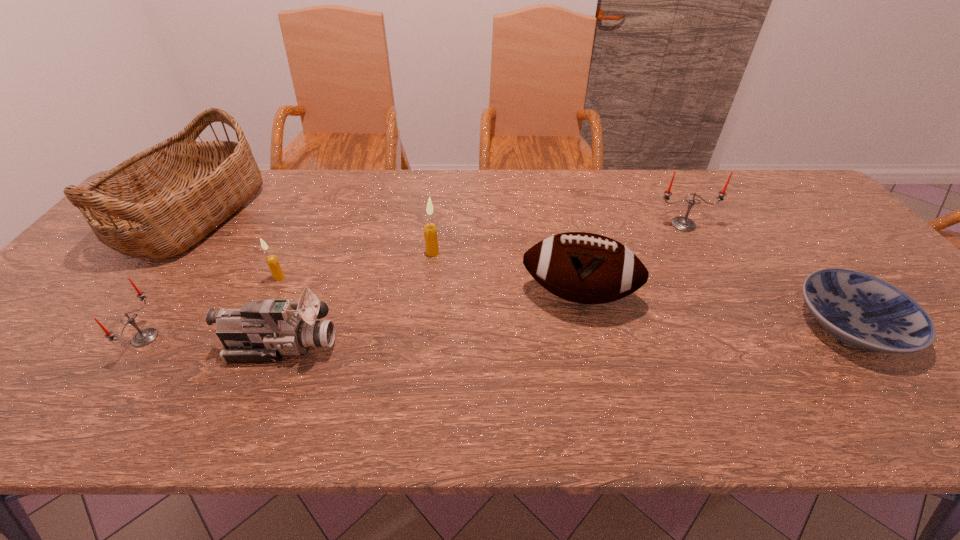
In order to click on vacant space located 0.110m on the front-facing side of the nearer red candle in this screenshot , I will do `click(205, 338)`.

Find the location of `free space located on the left of the plate`. free space located on the left of the plate is located at coordinates (776, 325).

The height and width of the screenshot is (540, 960). In order to click on object located at the far edge in this screenshot , I will do click(x=157, y=204).

The width and height of the screenshot is (960, 540). What are the coordinates of `object present at the left edge` in the screenshot? It's located at (157, 204).

Where is `object at the right edge`? object at the right edge is located at coordinates (864, 311).

Locate an element on the screen. This screenshot has width=960, height=540. object located in the far left corner section of the desktop is located at coordinates (157, 204).

What are the coordinates of `free space at the far edge` in the screenshot? It's located at (372, 187).

At what (x,y) coordinates should I click in order to perform the action: click on free space at the near edge of the desktop. Please return your answer as a coordinate pair (x, y). This screenshot has width=960, height=540. Looking at the image, I should click on (605, 426).

Where is `blank space at the left edge of the desktop`? The height and width of the screenshot is (540, 960). blank space at the left edge of the desktop is located at coordinates (100, 252).

What are the coordinates of `free space at the right edge of the desktop` in the screenshot? It's located at (819, 244).